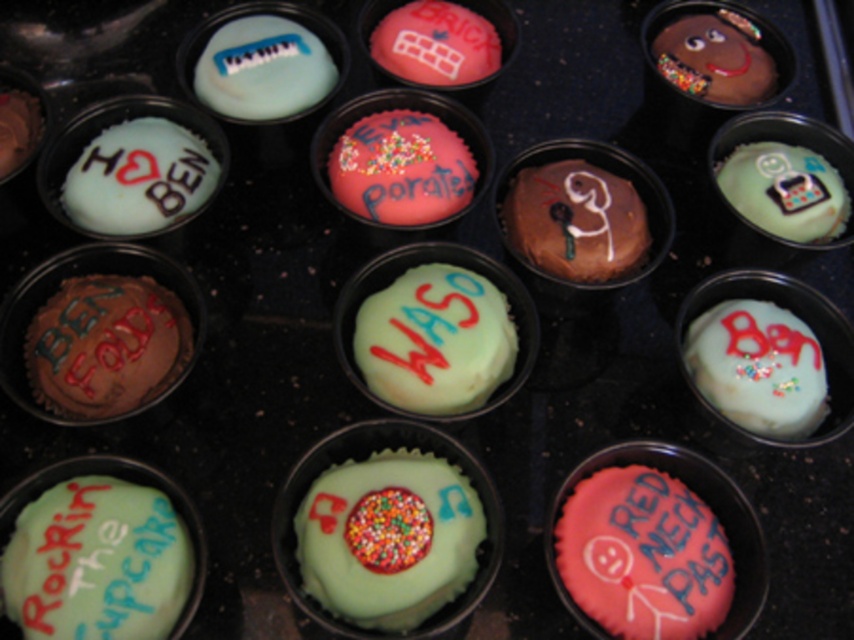
You are a customer at a bakery and want to choose a cupcake. You see the brown chocolate cupcake at left and the pink frosted cupcake at center right. If you want to pick both cupcakes, will you be able to hold them comfortably in one hand without them touching each other?

The distance between the brown chocolate cupcake at left and the pink frosted cupcake at center right is 50.02 centimeters. Since this distance is quite large, holding both cupcakes comfortably in one hand without them touching is not feasible as the space between them is too wide for a single hand to cover.

You are standing at the center of the cupcakes arrangement. Which of the two points, point (149,316) or point (740,632), is closer to you?

Point (149,316) is behind point (740,632), so the closer point to you is point (740,632).

You are looking at a tray of cupcakes arranged in a muffin tin. You see a brown chocolate cupcake at left. Can you tell me the exact coordinates where it is located?

The brown chocolate cupcake at left is located at point [104,346].